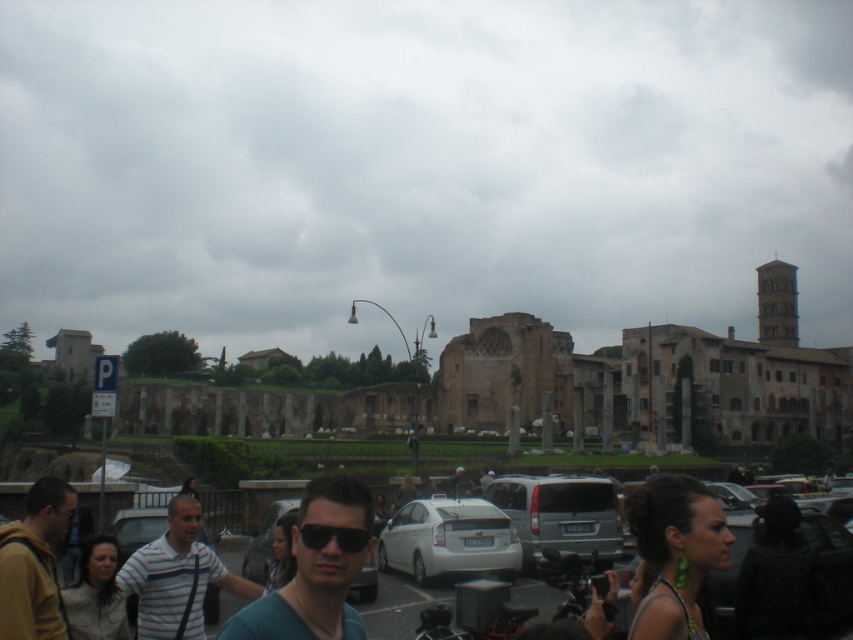
Can you confirm if white matte car at center is positioned above black matte sunglasses at center?

Incorrect, white matte car at center is not positioned above black matte sunglasses at center.

Between white matte car at center and black matte sunglasses at center, which one appears on the right side from the viewer's perspective?

From the viewer's perspective, white matte car at center appears more on the right side.

Which is behind, point (456, 532) or point (345, 547)?

The point (456, 532) is more distant.

In order to click on white matte car at center in this screenshot , I will do `click(448, 540)`.

Is point (215, 570) behind point (74, 508)?

Yes, point (215, 570) is farther from viewer.

Between striped cotton shirt at center and black plastic goggles at center, which one is positioned lower?

striped cotton shirt at center

Where is `striped cotton shirt at center`? striped cotton shirt at center is located at coordinates (177, 577).

Is dark brown leather jacket at lower left shorter than black matte sunglasses at center?

No.

Does dark brown leather jacket at lower left have a smaller size compared to black matte sunglasses at center?

No.

You are a GUI agent. You are given a task and a screenshot of the screen. Output one action in this format:
    pyautogui.click(x=<x>, y=<y>)
    Task: Click on the dark brown leather jacket at lower left
    
    Given the screenshot: What is the action you would take?
    pyautogui.click(x=33, y=564)

Locate an element on the screen. dark brown leather jacket at lower left is located at coordinates (33, 564).